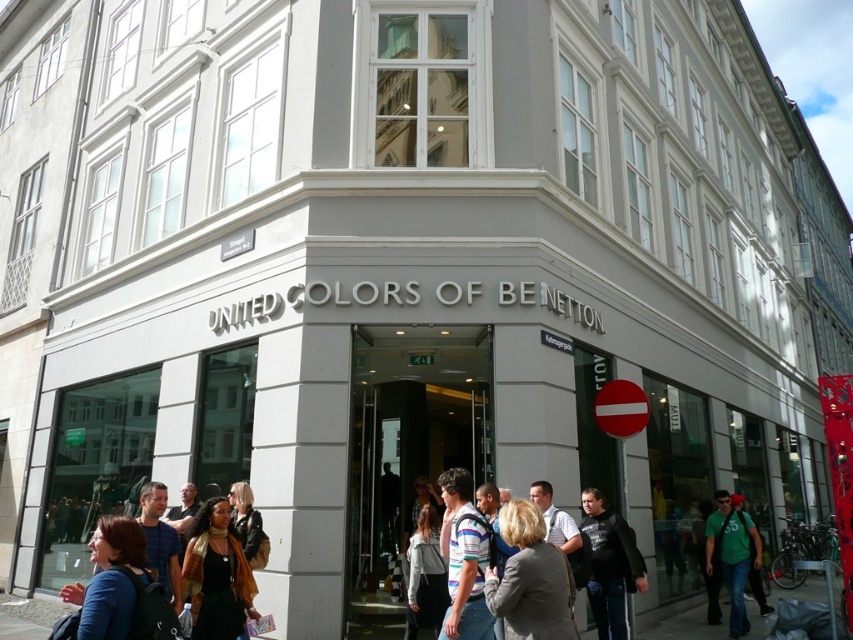
You are a delivery person trying to place a package on the ground in front of the United Colors of Benetton store. You see the black leather jacket at lower center and the concrete pavement at lower center. Where should you place the package so it doesn not get in the way of the pavement?

The black leather jacket at lower center is located above concrete pavement at lower center, so placing the package on the concrete pavement at lower center would keep it out of the way of the pavement itself.